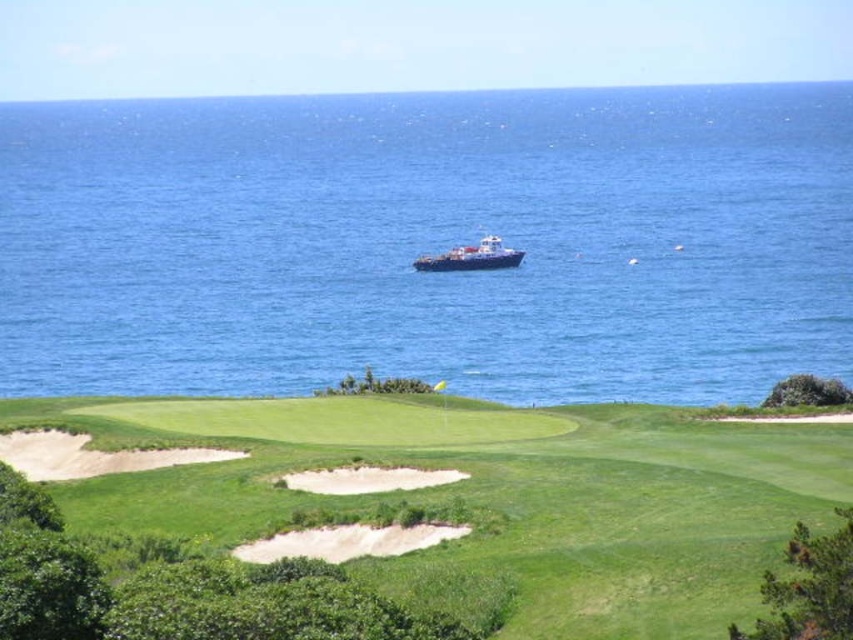
You are a golfer standing on the green grassy golf course at lower center and want to hit the ball towards the white sand bunker at center. Which direction should you aim your shot?

The green grassy golf course at lower center is located above the white sand bunker at center, so you should aim downward to hit the ball towards the white sand bunker at center.

You are a golfer standing on the green grassy golf course at lower center and want to hit the ball towards the white sand bunker at center. In which direction should you aim relative to your current position?

You should aim to the left since the green grassy golf course at lower center is to the right of the white sand bunker at center, meaning the bunker is located to your left.